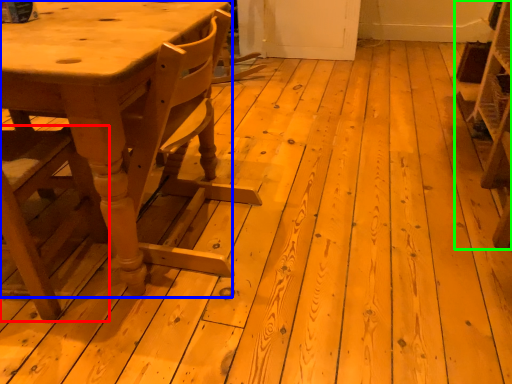
Question: Based on their relative distances, which object is farther from chair (highlighted by a red box)? Choose from table (highlighted by a blue box) and shelf (highlighted by a green box).

Choices:
 (A) table
 (B) shelf

Answer: (B)